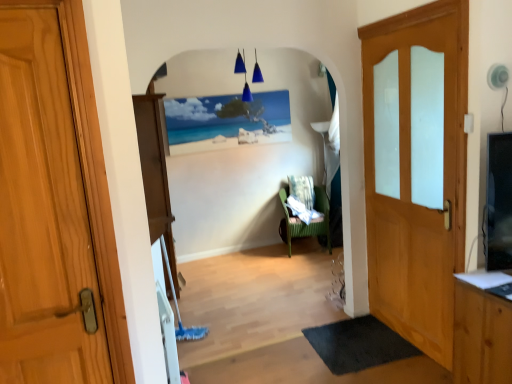
Where is `vacant space situated above wooden door with frosted glass panels at right, placed as the second door when sorted from front to back (from a real-world perspective)`? Image resolution: width=512 pixels, height=384 pixels. vacant space situated above wooden door with frosted glass panels at right, placed as the second door when sorted from front to back (from a real-world perspective) is located at coordinates (408, 10).